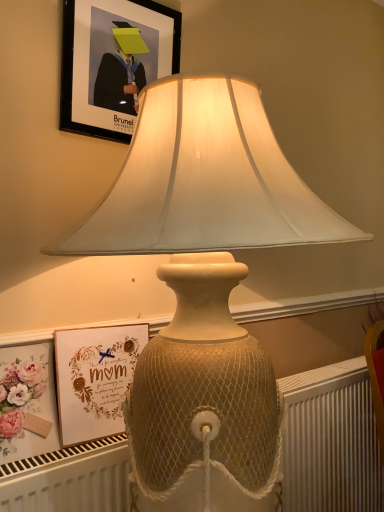
Question: From the image's perspective, is matte gold picture frame at lower left, the first picture frame from the bottom, above black matte picture frame at upper center, the second picture frame in the bottom-to-top sequence?

Choices:
 (A) yes
 (B) no

Answer: (B)

Question: Is matte gold picture frame at lower left, the first picture frame from the bottom, next to black matte picture frame at upper center, the first picture frame in the top-to-bottom sequence, and touching it?

Choices:
 (A) yes
 (B) no

Answer: (B)

Question: Can you confirm if matte gold picture frame at lower left, the first picture frame from the bottom, is wider than black matte picture frame at upper center, the second picture frame in the bottom-to-top sequence?

Choices:
 (A) yes
 (B) no

Answer: (A)

Question: From a real-world perspective, is matte gold picture frame at lower left, positioned as the 2th picture frame in top-to-bottom order, located higher than black matte picture frame at upper center, the second picture frame in the bottom-to-top sequence?

Choices:
 (A) no
 (B) yes

Answer: (A)

Question: Considering the relative positions of matte gold picture frame at lower left, the first picture frame from the bottom, and black matte picture frame at upper center, the first picture frame in the top-to-bottom sequence, in the image provided, is matte gold picture frame at lower left, the first picture frame from the bottom, to the left of black matte picture frame at upper center, the first picture frame in the top-to-bottom sequence, from the viewer's perspective?

Choices:
 (A) no
 (B) yes

Answer: (B)

Question: From the image's perspective, relative to matte gold picture frame at lower left, the first picture frame from the bottom, is white textured radiator at lower center above or below?

Choices:
 (A) below
 (B) above

Answer: (A)

Question: Would you say white textured radiator at lower center is to the left or to the right of matte gold picture frame at lower left, the first picture frame from the bottom, in the picture?

Choices:
 (A) right
 (B) left

Answer: (A)

Question: In the image, is white textured radiator at lower center positioned in front of or behind matte gold picture frame at lower left, the first picture frame from the bottom?

Choices:
 (A) front
 (B) behind

Answer: (A)

Question: Is white textured radiator at lower center wider or thinner than matte gold picture frame at lower left, the first picture frame from the bottom?

Choices:
 (A) wide
 (B) thin

Answer: (A)

Question: Considering the positions of black matte picture frame at upper center, the first picture frame in the top-to-bottom sequence, and matte gold picture frame at lower left, positioned as the 2th picture frame in top-to-bottom order, in the image, is black matte picture frame at upper center, the first picture frame in the top-to-bottom sequence, bigger or smaller than matte gold picture frame at lower left, positioned as the 2th picture frame in top-to-bottom order,?

Choices:
 (A) big
 (B) small

Answer: (B)

Question: From their relative heights in the image, would you say black matte picture frame at upper center, the second picture frame in the bottom-to-top sequence, is taller or shorter than matte gold picture frame at lower left, the first picture frame from the bottom?

Choices:
 (A) short
 (B) tall

Answer: (B)

Question: From the image's perspective, is black matte picture frame at upper center, the second picture frame in the bottom-to-top sequence, above or below matte gold picture frame at lower left, the first picture frame from the bottom?

Choices:
 (A) below
 (B) above

Answer: (B)

Question: Would you say black matte picture frame at upper center, the second picture frame in the bottom-to-top sequence, is inside or outside matte gold picture frame at lower left, positioned as the 2th picture frame in top-to-bottom order?

Choices:
 (A) inside
 (B) outside

Answer: (B)

Question: From a real-world perspective, is matte gold picture frame at lower left, positioned as the 2th picture frame in top-to-bottom order, above or below black matte picture frame at upper center, the first picture frame in the top-to-bottom sequence?

Choices:
 (A) above
 (B) below

Answer: (B)

Question: Is matte gold picture frame at lower left, positioned as the 2th picture frame in top-to-bottom order, taller or shorter than black matte picture frame at upper center, the second picture frame in the bottom-to-top sequence?

Choices:
 (A) short
 (B) tall

Answer: (A)